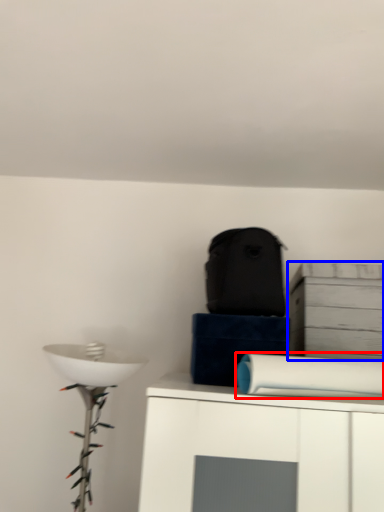
Question: Which point is closer to the camera, toilet paper (highlighted by a red box) or cabinetry (highlighted by a blue box)?

Choices:
 (A) toilet paper
 (B) cabinetry

Answer: (A)